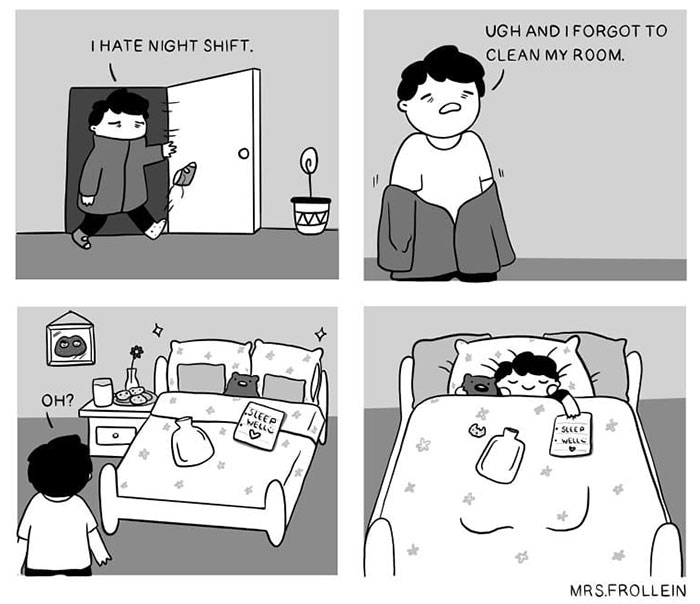
At what (x,y) coordinates should I click in order to perform the action: click on art. Please return your answer as a coordinate pair (x, y). Looking at the image, I should click on (70, 338).